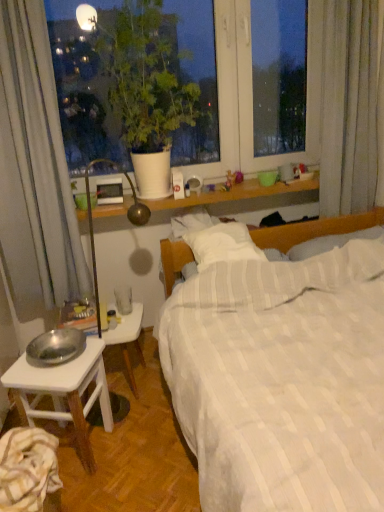
Image resolution: width=384 pixels, height=512 pixels. Find the location of `empty space that is ontop of silver metallic bowl at lower left`. empty space that is ontop of silver metallic bowl at lower left is located at coordinates (54, 360).